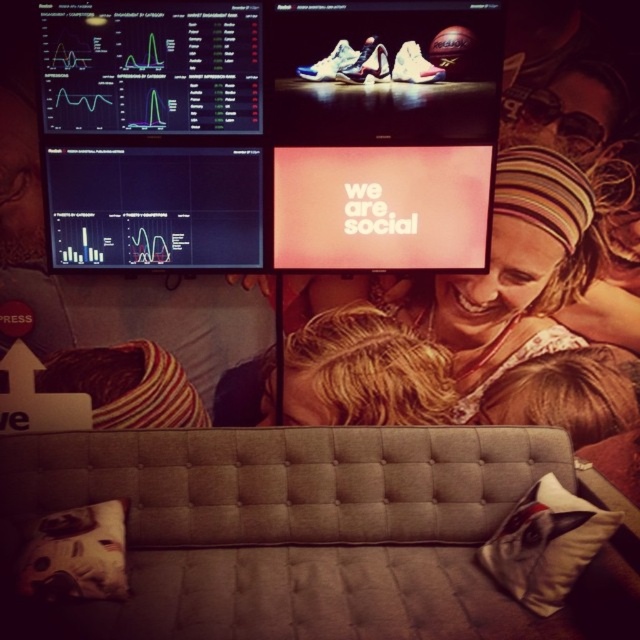
Question: Which point is closer to the camera?

Choices:
 (A) (544, 225)
 (B) (164, 8)

Answer: (B)

Question: Among these points, which one is farthest from the camera?

Choices:
 (A) (540, 563)
 (B) (548, 257)
 (C) (12, 550)
 (D) (36, 572)

Answer: (B)

Question: Does matte plastic screen at upper center have a larger size compared to matte pink headband at center?

Choices:
 (A) yes
 (B) no

Answer: (A)

Question: Can you confirm if matte plastic screen at upper center is smaller than matte pink headband at center?

Choices:
 (A) no
 (B) yes

Answer: (A)

Question: Which point appears farthest from the camera in this image?

Choices:
 (A) (545, 296)
 (B) (10, 566)
 (C) (29, 554)

Answer: (A)

Question: Does tufted fabric couch at lower center appear under white fabric pillow at lower right?

Choices:
 (A) no
 (B) yes

Answer: (B)